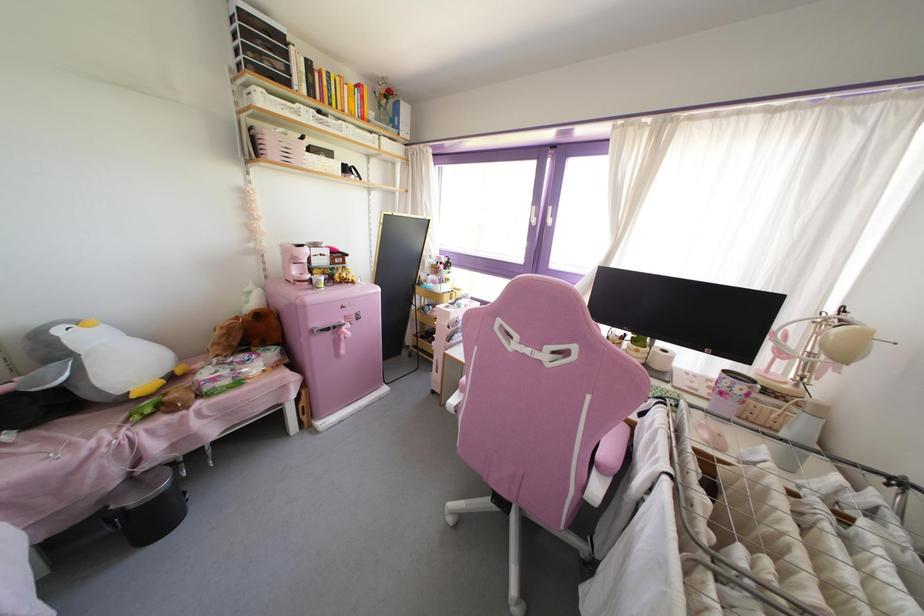
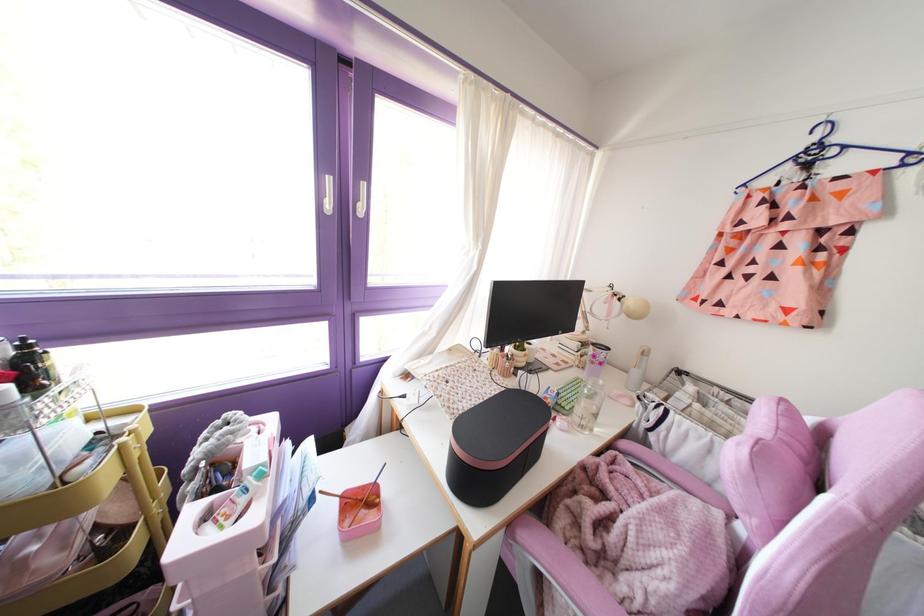
Where in the second image is the point corresponding to the point at 458,290 from the first image?

(130, 411)